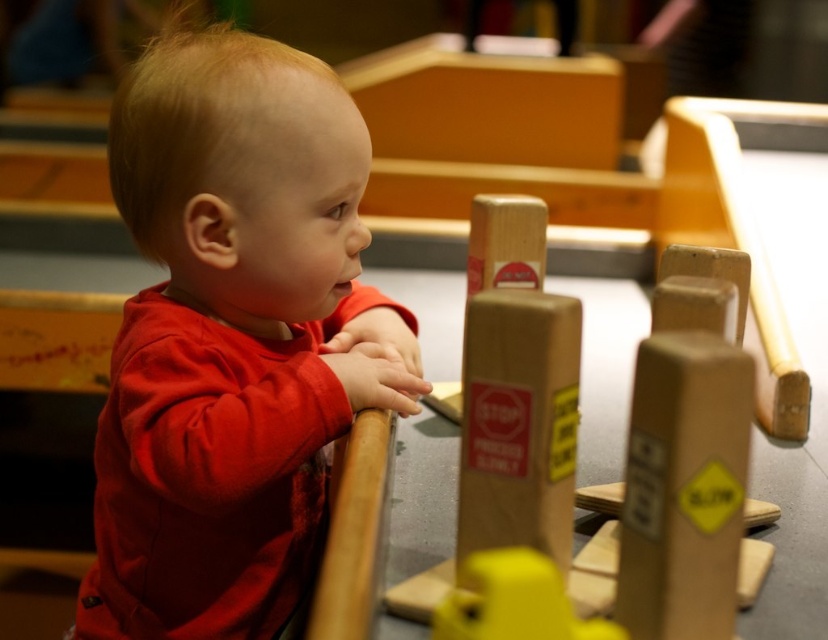
Measure the distance between point (x=195, y=577) and camera.

Point (x=195, y=577) is 96.22 centimeters away from camera.

From the picture: Which is below, red matte shirt at left or wooden sign at center?

Positioned lower is red matte shirt at left.

Is point (229, 186) farther from camera compared to point (535, 212)?

No, (229, 186) is closer to viewer.

Identify the location of red matte shirt at left. point(233,339).